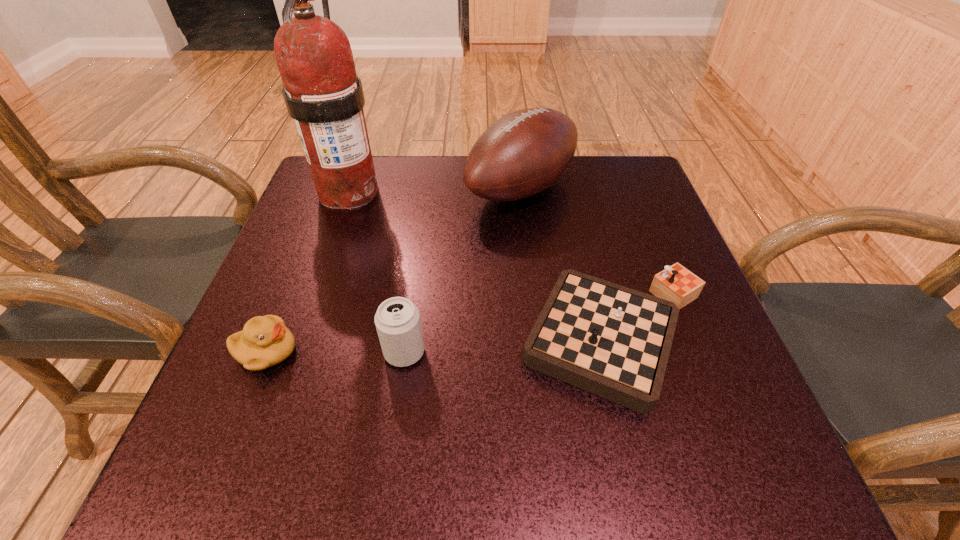
Where is `free point between the duckling and the third tallest object`? free point between the duckling and the third tallest object is located at coordinates (335, 352).

Where is `vacant area that lies between the tallest object and the fourth tallest object`? The image size is (960, 540). vacant area that lies between the tallest object and the fourth tallest object is located at coordinates pyautogui.click(x=307, y=272).

Where is `vacant space that's between the tallest object and the shortest object`? The height and width of the screenshot is (540, 960). vacant space that's between the tallest object and the shortest object is located at coordinates (484, 264).

Choose which object is the third nearest neighbor to the second tallest object. Please provide its 2D coordinates. Your answer should be formatted as a tuple, i.e. [(x, y)], where the tuple contains the x and y coordinates of a point satisfying the conditions above.

[(397, 320)]

Where is `object that is the third closest one to the football (American)`? object that is the third closest one to the football (American) is located at coordinates (397, 320).

In order to click on free spot that satisfies the following two spatial constraints: 1. at the beak of the duckling; 2. on the back side of the third tallest object in this screenshot , I will do `click(266, 352)`.

Where is `vacant position in the image that satisfies the following two spatial constraints: 1. at the nozzle of the shortest object; 2. on the left side of the fire extinguisher`? vacant position in the image that satisfies the following two spatial constraints: 1. at the nozzle of the shortest object; 2. on the left side of the fire extinguisher is located at coordinates pos(298,337).

Find the location of `vacant space that satisfies the following two spatial constraints: 1. at the nozzle of the tallest object; 2. at the beak of the fourth tallest object`. vacant space that satisfies the following two spatial constraints: 1. at the nozzle of the tallest object; 2. at the beak of the fourth tallest object is located at coordinates (292, 352).

This screenshot has width=960, height=540. I want to click on vacant area in the image that satisfies the following two spatial constraints: 1. on the front side of the fourth shortest object; 2. at the beak of the second shortest object, so click(540, 352).

This screenshot has height=540, width=960. Identify the location of vacant space that satisfies the following two spatial constraints: 1. at the beak of the can; 2. on the left side of the fourth tallest object. (266, 352).